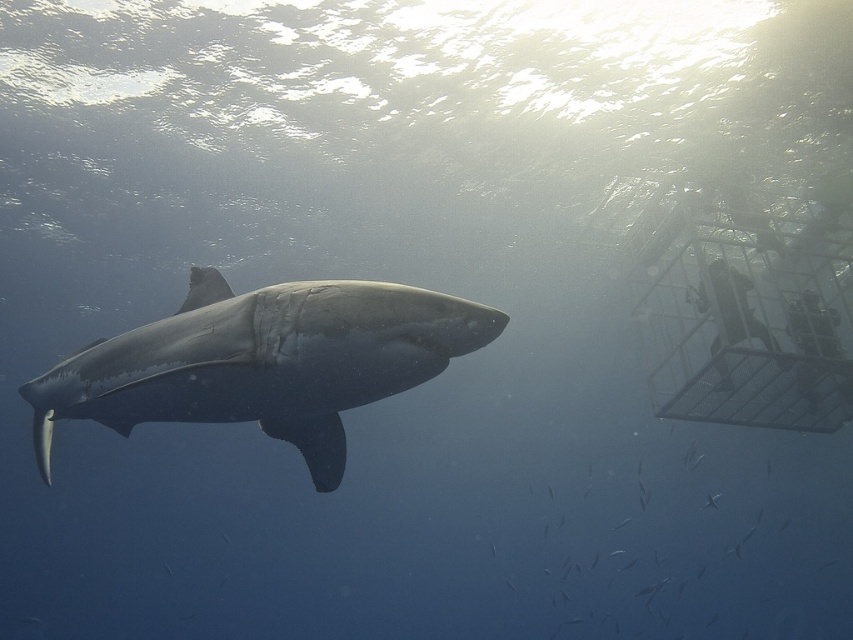
Find the location of a particular element. The width and height of the screenshot is (853, 640). black rubber wetsuit at right is located at coordinates (733, 316).

Can you confirm if black rubber wetsuit at right is shorter than metallic silver cage at right?

No, black rubber wetsuit at right is not shorter than metallic silver cage at right.

The width and height of the screenshot is (853, 640). Identify the location of black rubber wetsuit at right. (733, 316).

Consider the image. Is shiny gray shark at center to the right of metallic silver cage at right from the viewer's perspective?

In fact, shiny gray shark at center is to the left of metallic silver cage at right.

This screenshot has height=640, width=853. Describe the element at coordinates (264, 362) in the screenshot. I see `shiny gray shark at center` at that location.

Is point (305, 323) behind point (840, 355)?

No, (305, 323) is in front of (840, 355).

Image resolution: width=853 pixels, height=640 pixels. Find the location of `shiny gray shark at center`. shiny gray shark at center is located at coordinates (264, 362).

Can you confirm if metallic silver birdcage at right is shorter than metallic silver cage at right?

No.

Is point (793, 269) farther from camera compared to point (791, 339)?

Yes.

The height and width of the screenshot is (640, 853). What are the coordinates of `metallic silver birdcage at right` in the screenshot? It's located at (750, 317).